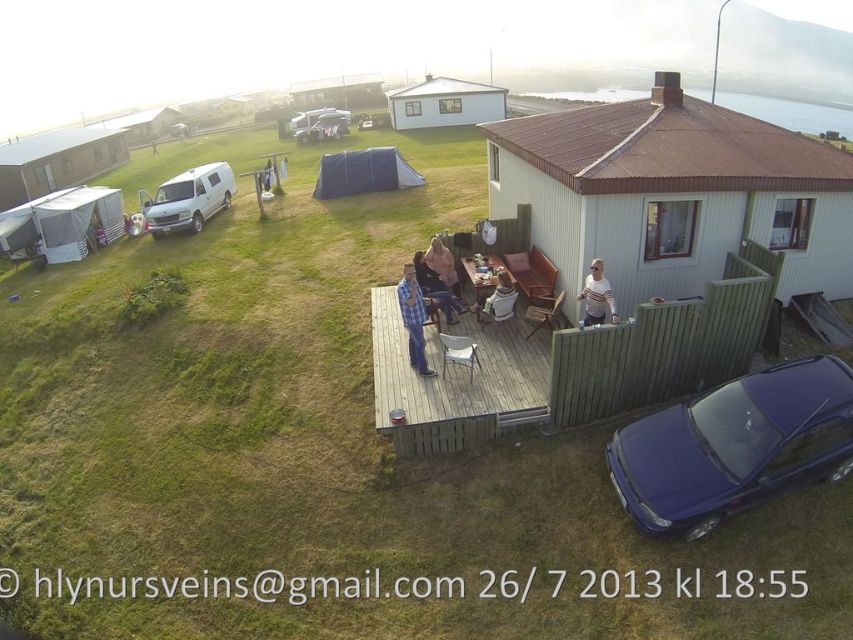
Is point (421, 330) positioned behind point (426, 278)?

No, (421, 330) is in front of (426, 278).

Who is positioned more to the left, checkered fabric shirt at center or matte blue shirt at center?

Positioned to the left is checkered fabric shirt at center.

What do you see at coordinates (413, 317) in the screenshot? The width and height of the screenshot is (853, 640). I see `checkered fabric shirt at center` at bounding box center [413, 317].

At what (x,y) coordinates should I click in order to perform the action: click on checkered fabric shirt at center. Please return your answer as a coordinate pair (x, y). This screenshot has height=640, width=853. Looking at the image, I should click on click(413, 317).

Does white matte van at left have a greater height compared to checkered fabric shirt at center?

Yes.

Can you confirm if white matte van at left is smaller than checkered fabric shirt at center?

No.

Describe the element at coordinates (187, 198) in the screenshot. I see `white matte van at left` at that location.

The height and width of the screenshot is (640, 853). What are the coordinates of `white matte van at left` in the screenshot? It's located at (187, 198).

Is wooden deck at center wider than checkered fabric shirt at center?

Indeed, wooden deck at center has a greater width compared to checkered fabric shirt at center.

Does point (447, 419) come closer to viewer compared to point (425, 316)?

Yes, point (447, 419) is closer to viewer.

Find the location of a particular element. The width and height of the screenshot is (853, 640). wooden deck at center is located at coordinates (454, 384).